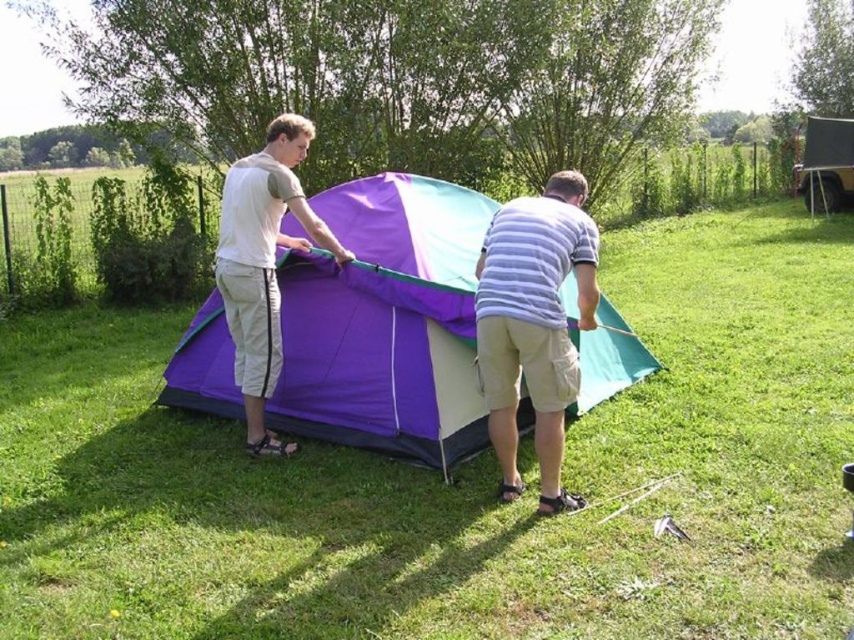
Does striped cotton shirt at center have a greater height compared to black canvas tent at right?

Incorrect, striped cotton shirt at center's height is not larger of black canvas tent at right's.

What do you see at coordinates (534, 324) in the screenshot?
I see `striped cotton shirt at center` at bounding box center [534, 324].

Identify the location of striped cotton shirt at center. (534, 324).

Can you confirm if purple fabric tent at center is thinner than striped cotton shirt at center?

Incorrect, purple fabric tent at center's width is not less than striped cotton shirt at center's.

Between purple fabric tent at center and striped cotton shirt at center, which one appears on the right side from the viewer's perspective?

striped cotton shirt at center is more to the right.

Does point (469, 324) lie in front of point (480, 372)?

No.

Where is `purple fabric tent at center`? The width and height of the screenshot is (854, 640). purple fabric tent at center is located at coordinates (385, 323).

Between purple fabric tent at center and black canvas tent at right, which one is positioned lower?

purple fabric tent at center is below.

Is point (326, 289) positioned before point (839, 129)?

Yes, point (326, 289) is closer to viewer.

Who is more distant from viewer, (x=278, y=282) or (x=804, y=172)?

The point (x=804, y=172) is more distant.

Image resolution: width=854 pixels, height=640 pixels. I want to click on purple fabric tent at center, so click(x=385, y=323).